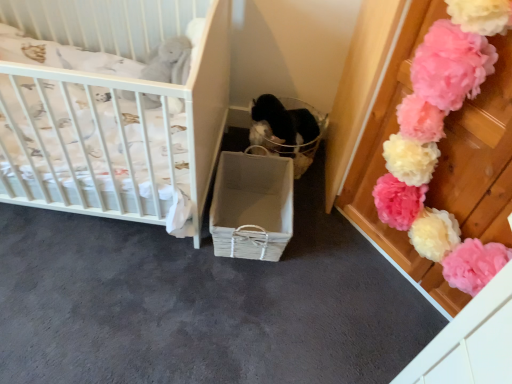
Question: From a real-world perspective, is white wicker basket at center over pink fluffy pom-pom at upper right?

Choices:
 (A) no
 (B) yes

Answer: (A)

Question: Is pink fluffy pom-pom at upper right at the back of white wicker basket at center?

Choices:
 (A) yes
 (B) no

Answer: (B)

Question: Is white wicker basket at center not inside pink fluffy pom-pom at upper right?

Choices:
 (A) yes
 (B) no

Answer: (A)

Question: Considering the relative positions of white wicker basket at center and pink fluffy pom-pom at upper right in the image provided, is white wicker basket at center in front of pink fluffy pom-pom at upper right?

Choices:
 (A) no
 (B) yes

Answer: (A)

Question: From the image's perspective, is white wicker basket at center on top of pink fluffy pom-pom at upper right?

Choices:
 (A) yes
 (B) no

Answer: (B)

Question: Is white wicker basket at center facing towards pink fluffy pom-pom at upper right?

Choices:
 (A) no
 (B) yes

Answer: (A)

Question: From the image's perspective, is translucent plastic basket at center below white wicker crib at left?

Choices:
 (A) yes
 (B) no

Answer: (A)

Question: Does translucent plastic basket at center come behind white wicker crib at left?

Choices:
 (A) no
 (B) yes

Answer: (B)

Question: Is white wicker crib at left located within translucent plastic basket at center?

Choices:
 (A) no
 (B) yes

Answer: (A)

Question: Does translucent plastic basket at center touch white wicker crib at left?

Choices:
 (A) yes
 (B) no

Answer: (B)

Question: Is translucent plastic basket at center bigger than white wicker crib at left?

Choices:
 (A) yes
 (B) no

Answer: (B)

Question: Is translucent plastic basket at center wider than white wicker crib at left?

Choices:
 (A) no
 (B) yes

Answer: (A)

Question: From a real-world perspective, is white wicker basket at center under white wicker crib at left?

Choices:
 (A) yes
 (B) no

Answer: (A)